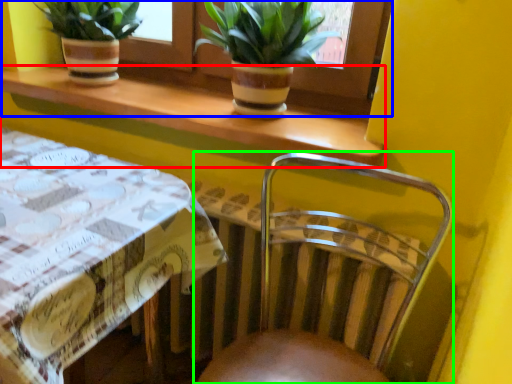
Question: Considering the real-world distances, which object is closest to window sill (highlighted by a red box)? window frame (highlighted by a blue box) or chair (highlighted by a green box).

Choices:
 (A) window frame
 (B) chair

Answer: (A)